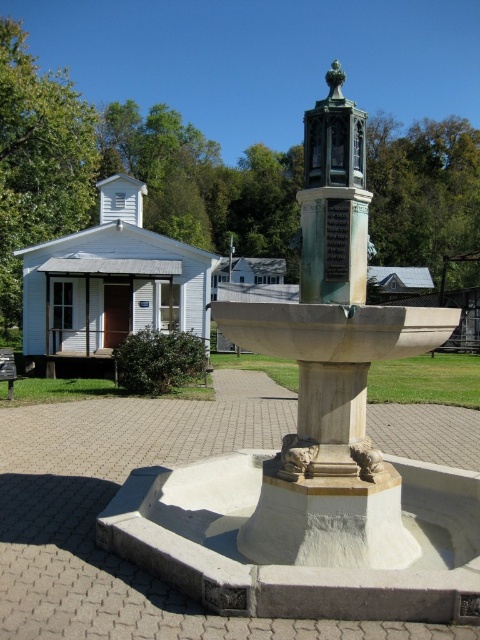
Question: Which point is closer to the camera?

Choices:
 (A) (362, 300)
 (B) (3, 374)
 (C) (333, 136)

Answer: (C)

Question: From the image, what is the correct spatial relationship of white stone fountain at center in relation to wooden park bench at lower left?

Choices:
 (A) right
 (B) left

Answer: (A)

Question: From the image, what is the correct spatial relationship of green patina metal bell tower at center in relation to wooden park bench at lower left?

Choices:
 (A) above
 (B) below

Answer: (A)

Question: Which of the following is the farthest from the observer?

Choices:
 (A) white stone fountain at center
 (B) wooden park bench at lower left
 (C) green patina metal bell tower at center

Answer: (B)

Question: Is green patina metal bell tower at center below wooden park bench at lower left?

Choices:
 (A) yes
 (B) no

Answer: (B)

Question: Which point appears closest to the camera in this image?

Choices:
 (A) (4, 371)
 (B) (359, 296)
 (C) (379, 458)

Answer: (C)